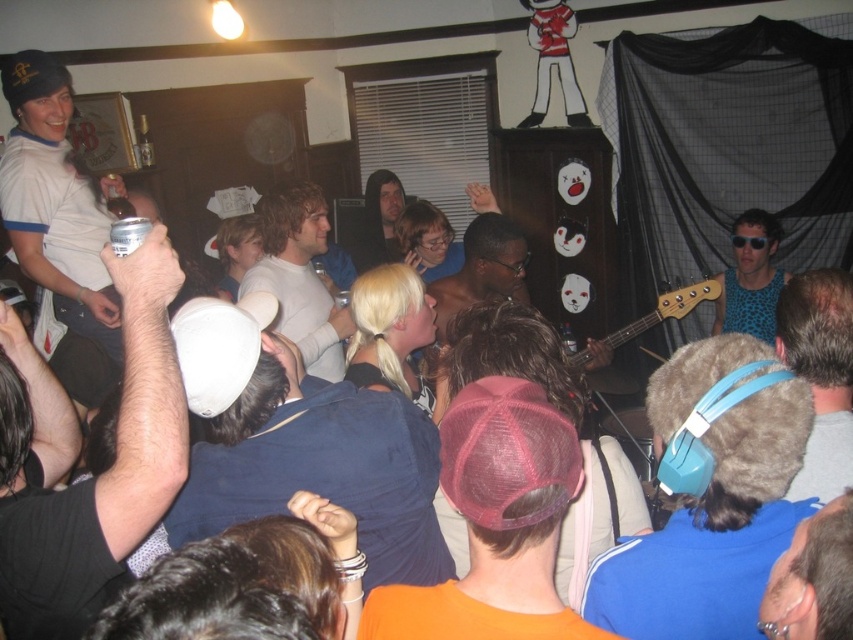
Question: Is matte white can at upper left to the left of brown fur hat at upper right from the viewer's perspective?

Choices:
 (A) no
 (B) yes

Answer: (B)

Question: Estimate the real-world distances between objects in this image. Which object is farther from the leopard print tank top at upper right?

Choices:
 (A) matte white cap at upper left
 (B) orange mesh cap at center
 (C) white matte t-shirt at center

Answer: (B)

Question: Does white fabric cap at center have a greater width compared to leopard print tank top at upper right?

Choices:
 (A) yes
 (B) no

Answer: (A)

Question: Among these points, which one is nearest to the camera?

Choices:
 (A) (177, 326)
 (B) (480, 394)
 (C) (792, 323)
 (D) (761, 586)

Answer: (B)

Question: Which object is farther from the camera taking this photo?

Choices:
 (A) smooth skin shirt at center
 (B) brown fur hat at upper right

Answer: (A)

Question: Can you confirm if white matte t-shirt at center is positioned above smooth brown leather jacket at lower right?

Choices:
 (A) yes
 (B) no

Answer: (A)